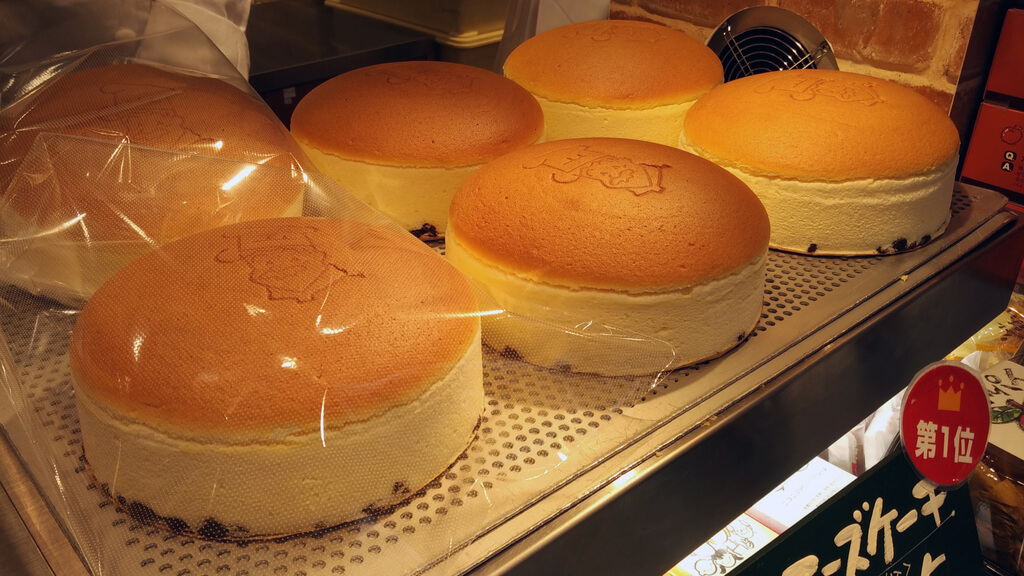
At what (x,y) coordinates should I click in order to perform the action: click on aluminum cooling rack. Please return your answer as a coordinate pair (x, y). The width and height of the screenshot is (1024, 576). Looking at the image, I should click on (820, 288).